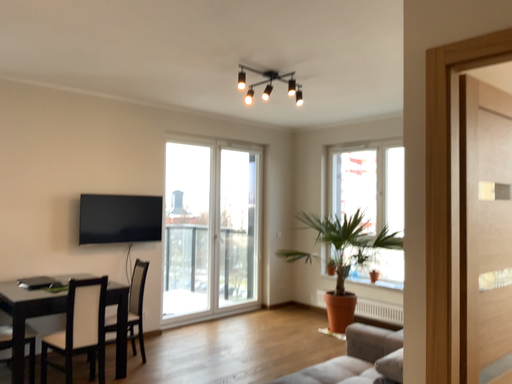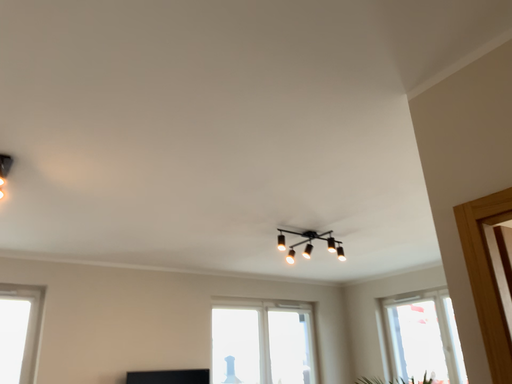
Question: Which way did the camera rotate in the video?

Choices:
 (A) rotated right
 (B) rotated left

Answer: (B)